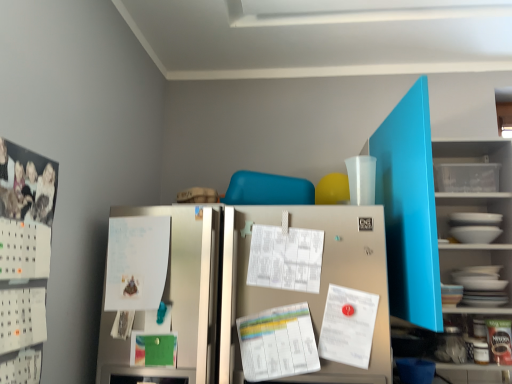
Question: Is white paper at center, which appears as the 3th paper when viewed from the right, at the back of satin silver refrigerator at center?

Choices:
 (A) yes
 (B) no

Answer: (B)

Question: Can you confirm if satin silver refrigerator at center is thinner than white paper at center, which appears as the 3th paper when viewed from the right?

Choices:
 (A) yes
 (B) no

Answer: (B)

Question: Considering the relative positions of satin silver refrigerator at center and white paper at center, the 1th paper in the left-to-right sequence, in the image provided, is satin silver refrigerator at center to the left of white paper at center, the 1th paper in the left-to-right sequence, from the viewer's perspective?

Choices:
 (A) yes
 (B) no

Answer: (B)

Question: From a real-world perspective, is satin silver refrigerator at center physically above white paper at center, which appears as the 3th paper when viewed from the right?

Choices:
 (A) no
 (B) yes

Answer: (A)

Question: Is satin silver refrigerator at center to the right of white paper at center, the 1th paper in the left-to-right sequence, from the viewer's perspective?

Choices:
 (A) yes
 (B) no

Answer: (A)

Question: Do you think white paper at center, the 2th paper from the left, is within white paper at center, placed as the 3th paper when sorted from left to right, or outside of it?

Choices:
 (A) inside
 (B) outside

Answer: (B)

Question: Considering the relative positions of white paper at center, the 2th paper from the left, and white paper at center, marked as the first paper in a right-to-left arrangement, in the image provided, is white paper at center, the 2th paper from the left, to the left or to the right of white paper at center, marked as the first paper in a right-to-left arrangement,?

Choices:
 (A) right
 (B) left

Answer: (B)

Question: Considering the positions of point coord(283,273) and point coord(351,327), is point coord(283,273) closer or farther from the camera than point coord(351,327)?

Choices:
 (A) farther
 (B) closer

Answer: (A)

Question: Considering their positions, is white paper at center, which appears as the second paper when viewed from the right, located in front of or behind white paper at center, marked as the first paper in a right-to-left arrangement?

Choices:
 (A) front
 (B) behind

Answer: (B)

Question: In terms of height, does white paper at center, the 1th paper in the left-to-right sequence, look taller or shorter compared to white paperboard at left?

Choices:
 (A) tall
 (B) short

Answer: (B)

Question: Based on their sizes in the image, would you say white paper at center, the 1th paper in the left-to-right sequence, is bigger or smaller than white paperboard at left?

Choices:
 (A) small
 (B) big

Answer: (A)

Question: Is point (159, 271) closer or farther from the camera than point (5, 177)?

Choices:
 (A) closer
 (B) farther

Answer: (B)

Question: From the image's perspective, is white paper at center, the 1th paper in the left-to-right sequence, above or below white paperboard at left?

Choices:
 (A) above
 (B) below

Answer: (B)

Question: Is point click(x=126, y=220) closer or farther from the camera than point click(x=302, y=243)?

Choices:
 (A) farther
 (B) closer

Answer: (A)

Question: From the image's perspective, is white paper at center, the 1th paper in the left-to-right sequence, above or below white paper at center, the 2th paper from the left?

Choices:
 (A) above
 (B) below

Answer: (B)